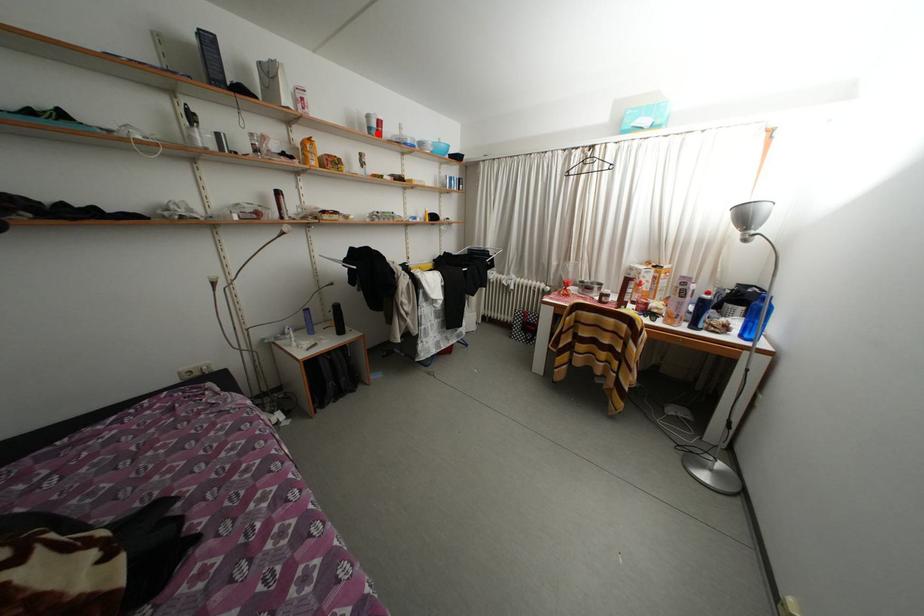
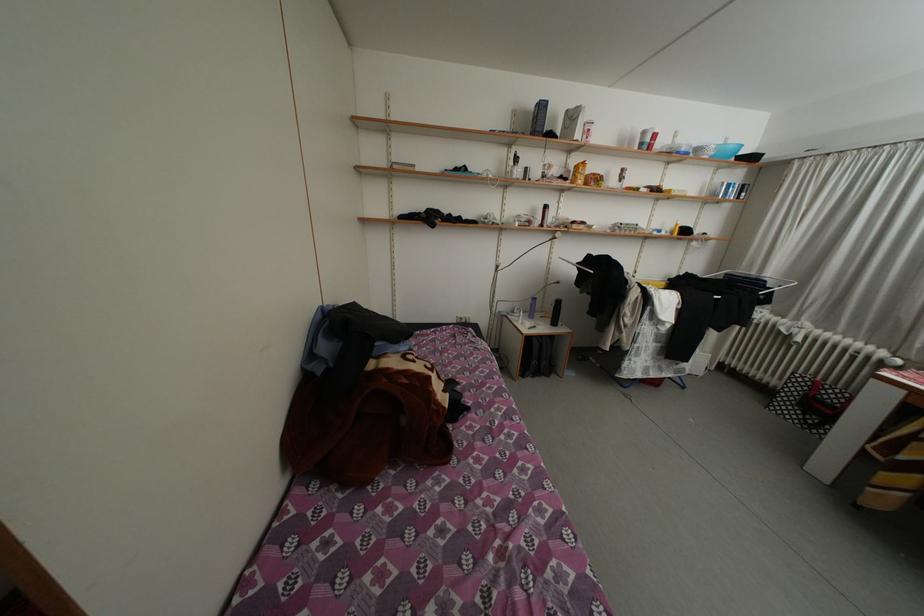
In the second image, find the point that corresponds to the highlighted location in the first image.

(650, 148)